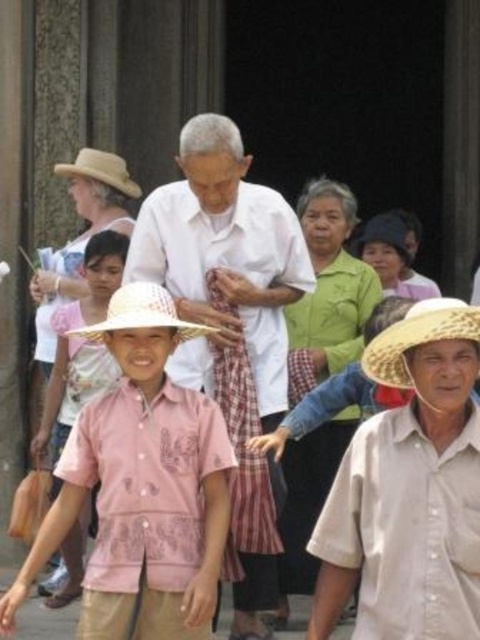
Is white matte shirt at center above white straw hat at center?

Actually, white matte shirt at center is below white straw hat at center.

This screenshot has height=640, width=480. What do you see at coordinates (224, 260) in the screenshot?
I see `white matte shirt at center` at bounding box center [224, 260].

Describe the element at coordinates (224, 260) in the screenshot. I see `white matte shirt at center` at that location.

Locate an element on the screen. Image resolution: width=480 pixels, height=640 pixels. white matte shirt at center is located at coordinates (224, 260).

Does white matte shirt at center have a greater height compared to strawmaterial/texturehat at lower right?

Yes, white matte shirt at center is taller than strawmaterial/texturehat at lower right.

Who is lower down, white matte shirt at center or strawmaterial/texturehat at lower right?

strawmaterial/texturehat at lower right

Identify the location of white matte shirt at center. (224, 260).

This screenshot has width=480, height=640. I want to click on white matte shirt at center, so click(224, 260).

Between point (275, 304) and point (96, 177), which one is positioned behind?

Point (96, 177)

The image size is (480, 640). Find the location of `white matte shirt at center`. white matte shirt at center is located at coordinates (224, 260).

At what (x,y) coordinates should I click in order to perform the action: click on white matte shirt at center. Please return your answer as a coordinate pair (x, y). Image resolution: width=480 pixels, height=640 pixels. Looking at the image, I should click on click(224, 260).

You are a GUI agent. You are given a task and a screenshot of the screen. Output one action in this format:
    pyautogui.click(x=<x>, y=<y>)
    Task: Click on the white matte shirt at center
    
    Given the screenshot: What is the action you would take?
    pyautogui.click(x=224, y=260)